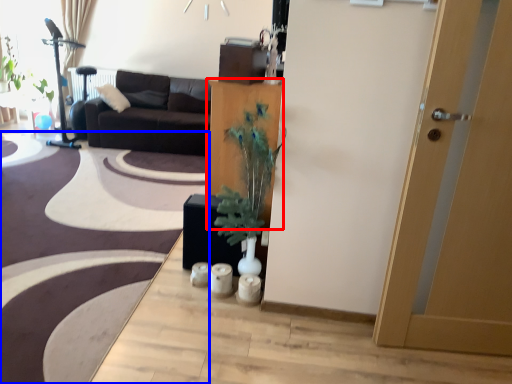
Question: Among these objects, which one is nearest to the camera, cabinetry (highlighted by a red box) or plain (highlighted by a blue box)?

Choices:
 (A) cabinetry
 (B) plain

Answer: (B)